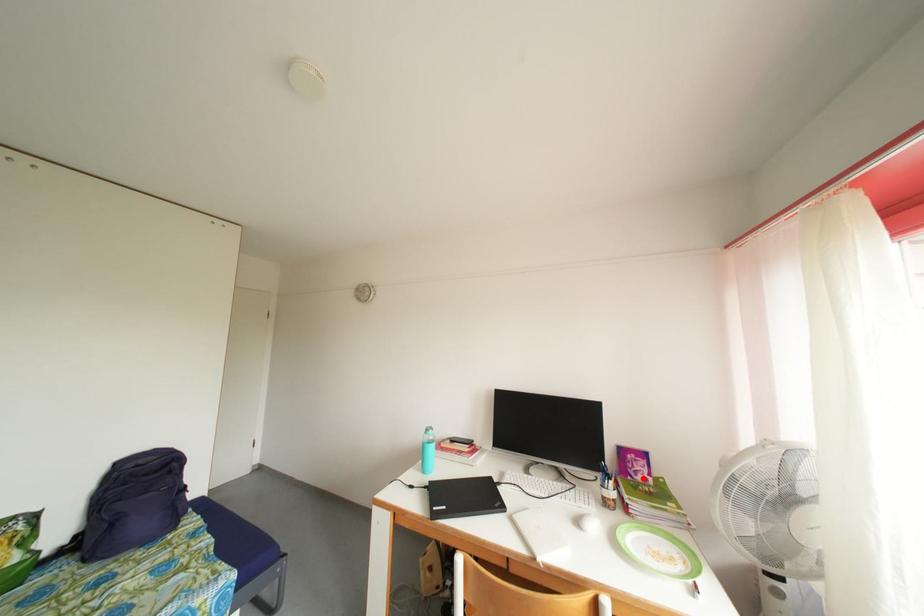
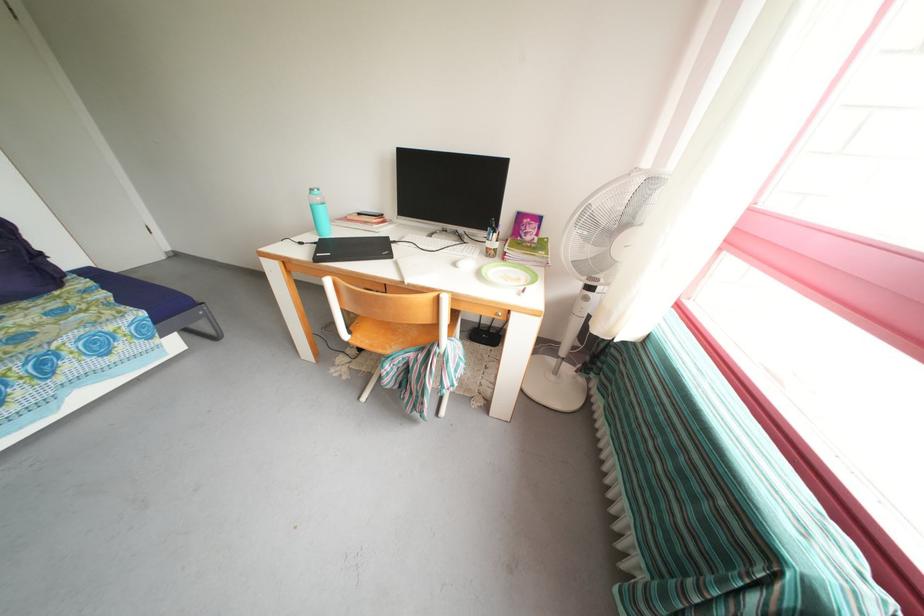
In the second image, find the point that corresponds to the highlighted location in the first image.

(532, 238)